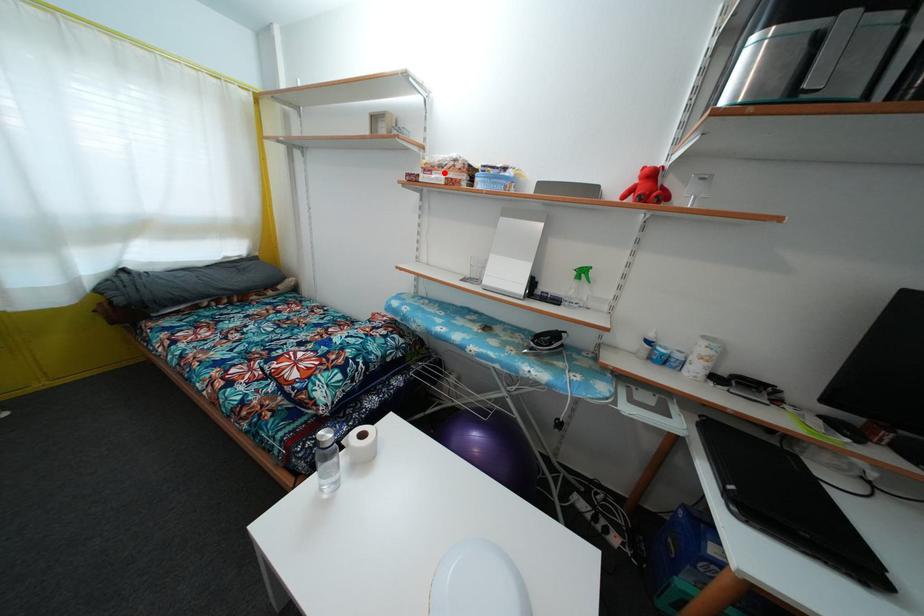
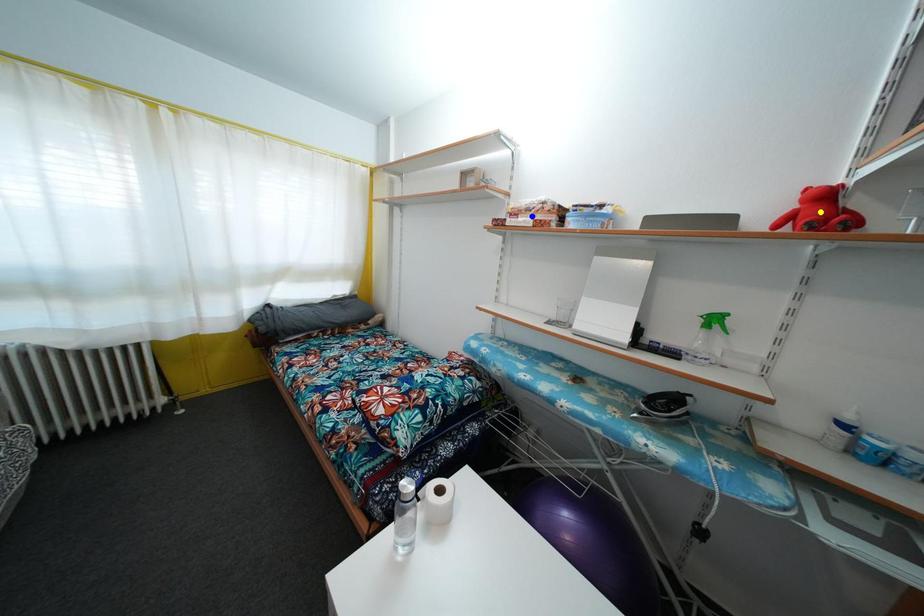
Question: I am providing you with two images of the same scene from different viewpoints. A red point is marked on the first image. You are given multiple points on the second image. In image 2, which mark is for the same physical point as the one in image 1?

Choices:
 (A) blue point
 (B) yellow point
 (C) green point

Answer: (A)